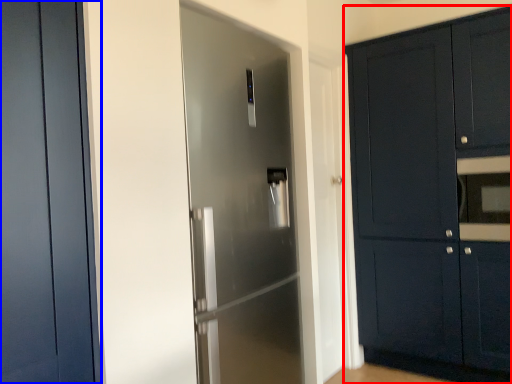
Question: Which point is closer to the camera, cabinetry (highlighted by a red box) or door (highlighted by a blue box)?

Choices:
 (A) cabinetry
 (B) door

Answer: (B)